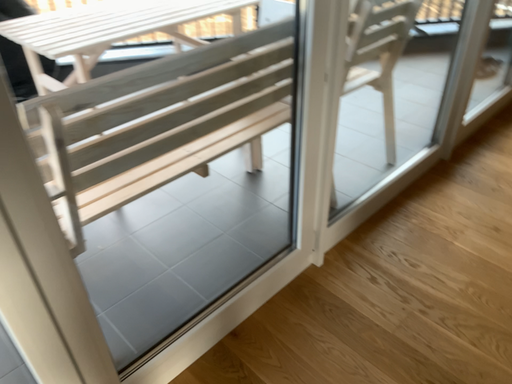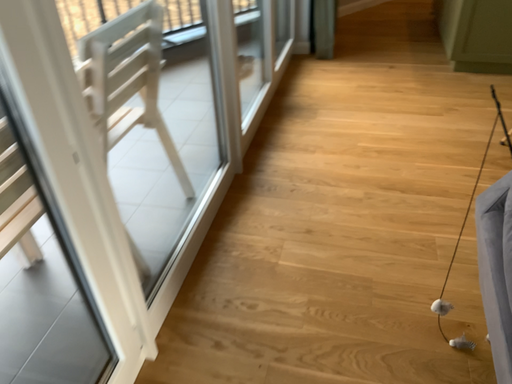
Question: How did the camera likely rotate when shooting the video?

Choices:
 (A) rotated right
 (B) rotated left

Answer: (A)